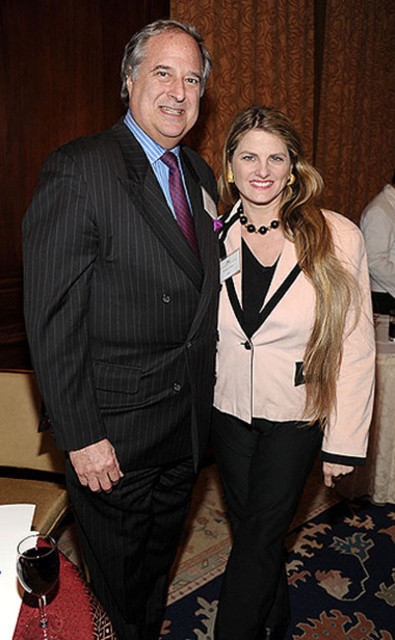
Question: Considering the real-world distances, which object is closest to the transparent glass at lower left?

Choices:
 (A) dark wood table at lower left
 (B) pinstriped suit at center
 (C) black pinstripe suit at center
 (D) pink fabric jacket at center

Answer: (A)

Question: Is pink fabric jacket at center above black pinstripe suit at center?

Choices:
 (A) yes
 (B) no

Answer: (B)

Question: Is transparent glass at lower left to the right of dark glass at lower left from the viewer's perspective?

Choices:
 (A) no
 (B) yes

Answer: (B)

Question: Considering the real-world distances, which object is farthest from the pink fabric jacket at center?

Choices:
 (A) transparent glass at lower left
 (B) dark wood table at lower left
 (C) pinstriped suit at center
 (D) dark glass at lower left

Answer: (D)

Question: Which of the following is the closest to the observer?

Choices:
 (A) pink fabric jacket at center
 (B) dark wood table at lower left
 (C) black pinstripe suit at center

Answer: (B)

Question: Is pink fabric jacket at center bigger than transparent glass at lower left?

Choices:
 (A) yes
 (B) no

Answer: (A)